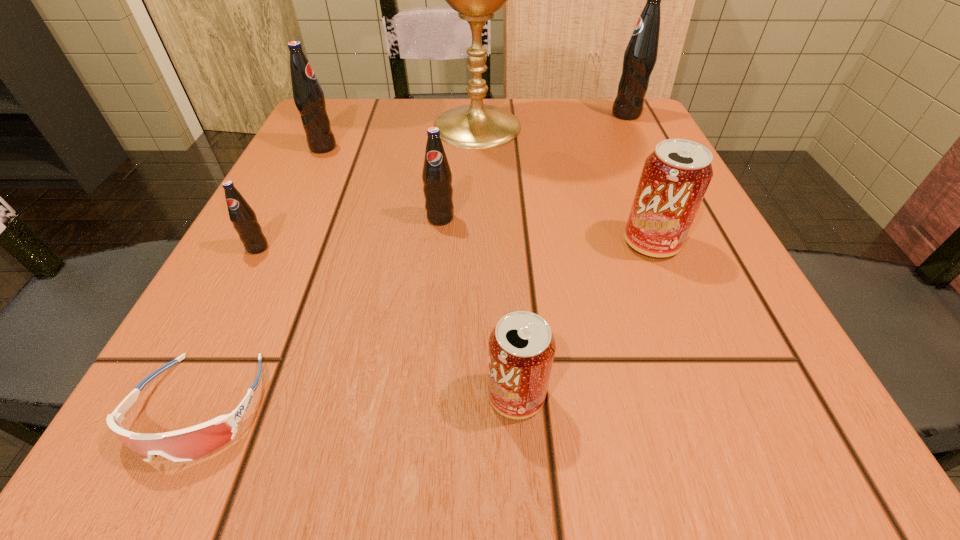
In order to click on vacant space that is in between the shortest object and the smaller red soda can in this screenshot , I will do `click(358, 401)`.

At what (x,y) coordinates should I click in order to perform the action: click on blank region between the second tallest soda can and the farther red soda can. Please return your answer as a coordinate pair (x, y). This screenshot has width=960, height=540. Looking at the image, I should click on (487, 195).

You are a GUI agent. You are given a task and a screenshot of the screen. Output one action in this format:
    pyautogui.click(x=<x>, y=<y>)
    Task: Click on the free space between the red goggles and the farther red soda can
    This screenshot has width=960, height=540.
    Given the screenshot: What is the action you would take?
    pyautogui.click(x=425, y=325)

This screenshot has height=540, width=960. I want to click on free spot between the third farthest black pop and the nearest black pop, so click(x=348, y=233).

Where is `object that is the seventh closest to the rightmost black pop`? This screenshot has width=960, height=540. object that is the seventh closest to the rightmost black pop is located at coordinates (191, 443).

This screenshot has width=960, height=540. What are the coordinates of `object that is the third nearest to the nearest soda can` in the screenshot? It's located at (437, 177).

Locate which soda can ranks fifth in proximity to the rightmost black pop. Please provide its 2D coordinates. Your answer should be formatted as a tuple, i.e. [(x, y)], where the tuple contains the x and y coordinates of a point satisfying the conditions above.

[(243, 217)]

Where is `soda can identified as the sixth closest to the red goggles`? Image resolution: width=960 pixels, height=540 pixels. soda can identified as the sixth closest to the red goggles is located at coordinates (640, 55).

Choose which black pop is the nearest neighbor to the smallest black pop. Please provide its 2D coordinates. Your answer should be formatted as a tuple, i.e. [(x, y)], where the tuple contains the x and y coordinates of a point satisfying the conditions above.

[(437, 177)]

Select which black pop appears as the second closest to the nearest soda can. Please provide its 2D coordinates. Your answer should be formatted as a tuple, i.e. [(x, y)], where the tuple contains the x and y coordinates of a point satisfying the conditions above.

[(243, 217)]